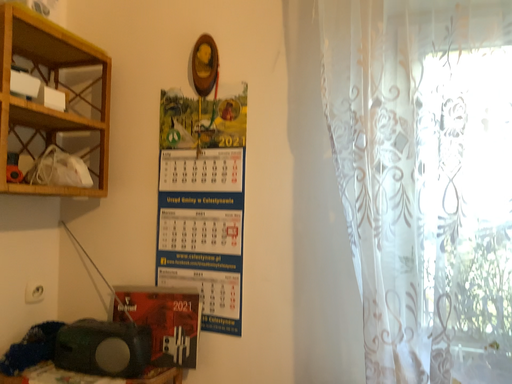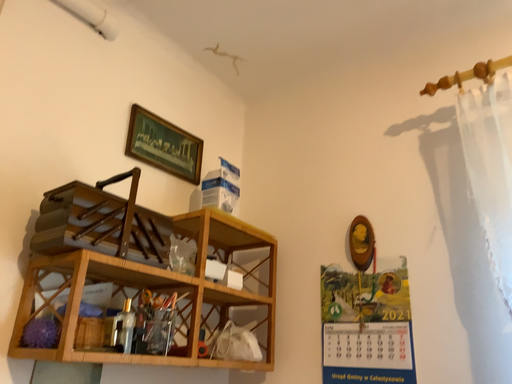
Question: How did the camera likely rotate when shooting the video?

Choices:
 (A) rotated downward
 (B) rotated upward

Answer: (B)